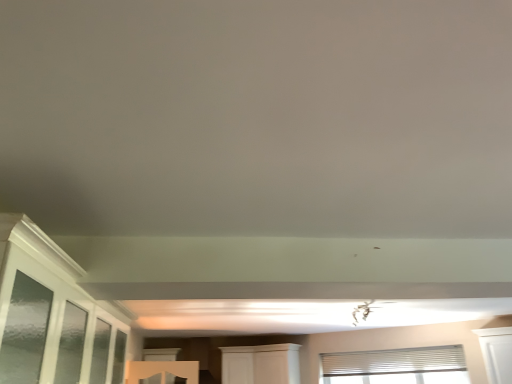
Question: In terms of width, does white textured blinds at upper right, the 1th window in the right-to-left sequence, look wider or thinner when compared to clear glass window at lower center, which is the 2th window from right to left?

Choices:
 (A) wide
 (B) thin

Answer: (B)

Question: In terms of size, does white textured blinds at upper right, the 1th window in the right-to-left sequence, appear bigger or smaller than clear glass window at lower center, which is the 2th window from right to left?

Choices:
 (A) small
 (B) big

Answer: (A)

Question: Which of these objects is positioned farthest from the white textured blinds at upper right, the 1th window in the right-to-left sequence?

Choices:
 (A) white wood cabinet at center
 (B) clear glass window at lower center, which is the 2th window from right to left

Answer: (B)

Question: Estimate the real-world distances between objects in this image. Which object is closer to the white wood cabinet at center?

Choices:
 (A) clear glass window at lower center, which is the 2th window from right to left
 (B) white textured blinds at upper right, the 1th window in the right-to-left sequence

Answer: (B)